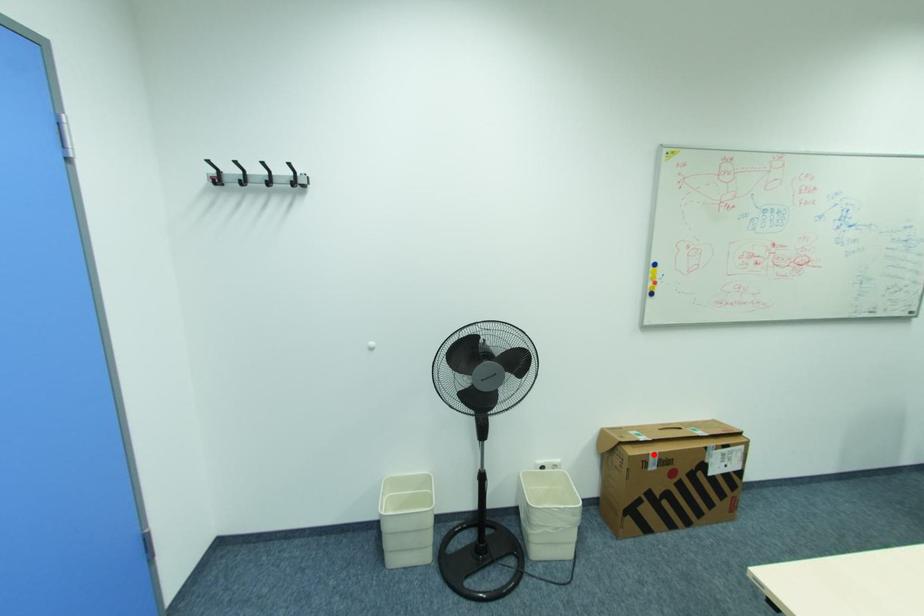
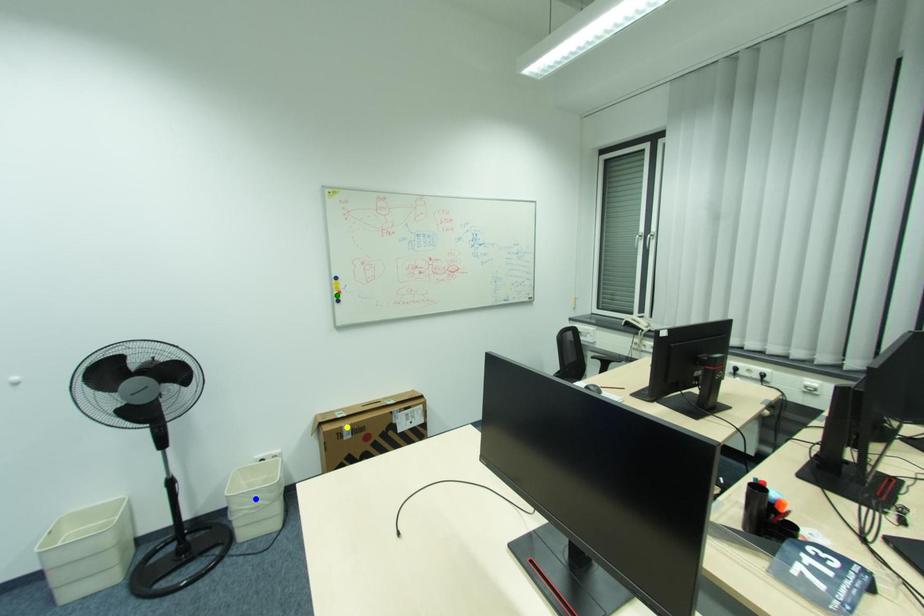
Question: I am providing you with two images of the same scene from different viewpoints. A red point is marked on the first image. You are given multiple points on the second image. Which point in image 2 represents the same 3d spot as the red point in image 1?

Choices:
 (A) green point
 (B) yellow point
 (C) blue point

Answer: (B)